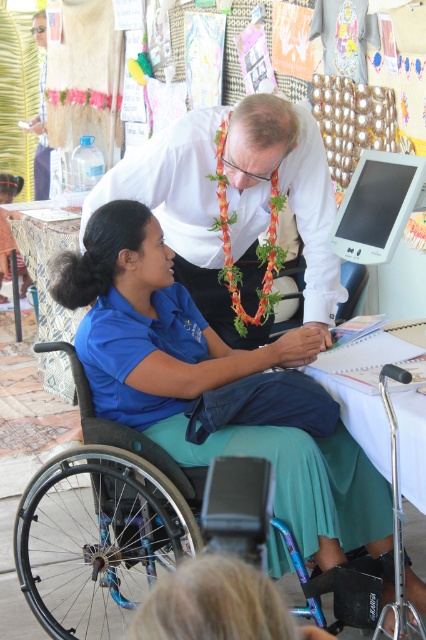
From the picture: Between white shirt at center and matte plastic computer screen at upper right, which one has less height?

Standing shorter between the two is matte plastic computer screen at upper right.

Is white shirt at center above matte plastic computer screen at upper right?

No, white shirt at center is not above matte plastic computer screen at upper right.

Who is more forward, [247,182] or [376,188]?

Positioned in front is point [376,188].

Identify the location of white shirt at center. [282, 192].

Is black plastic wheelchair at lower left to the left of matte plastic computer screen at upper right from the viewer's perspective?

Correct, you'll find black plastic wheelchair at lower left to the left of matte plastic computer screen at upper right.

Can you confirm if black plastic wheelchair at lower left is positioned above matte plastic computer screen at upper right?

Incorrect, black plastic wheelchair at lower left is not positioned above matte plastic computer screen at upper right.

Is point (14, 529) behind point (408, 173)?

Yes, it is.

The image size is (426, 640). What are the coordinates of `black plastic wheelchair at lower left` in the screenshot? It's located at (103, 524).

Does white shirt at center appear over white paper at center?

Correct, white shirt at center is located above white paper at center.

This screenshot has width=426, height=640. What are the coordinates of `white shirt at center` in the screenshot? It's located at (282, 192).